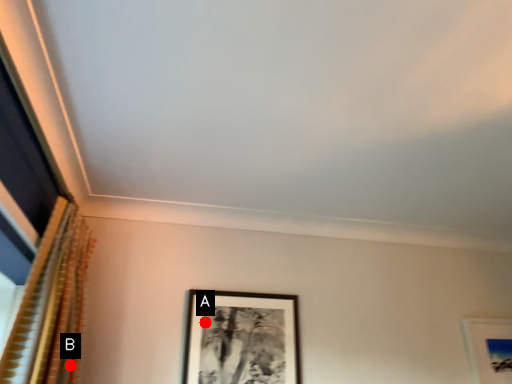
Question: Two points are circled on the image, labeled by A and B beside each circle. Which point appears closest to the camera in this image?

Choices:
 (A) A is closer
 (B) B is closer

Answer: (B)